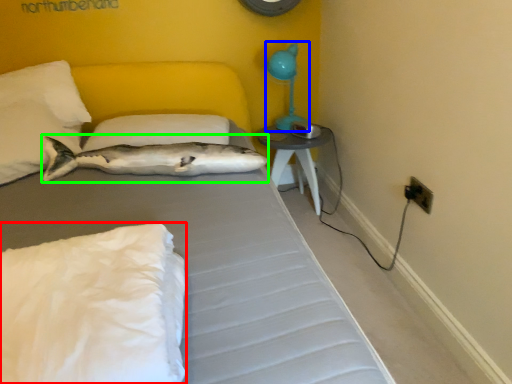
Question: Which object is positioned farthest from pillow (highlighted by a red box)? Select from table lamp (highlighted by a blue box) and fish (highlighted by a green box).

Choices:
 (A) table lamp
 (B) fish

Answer: (A)